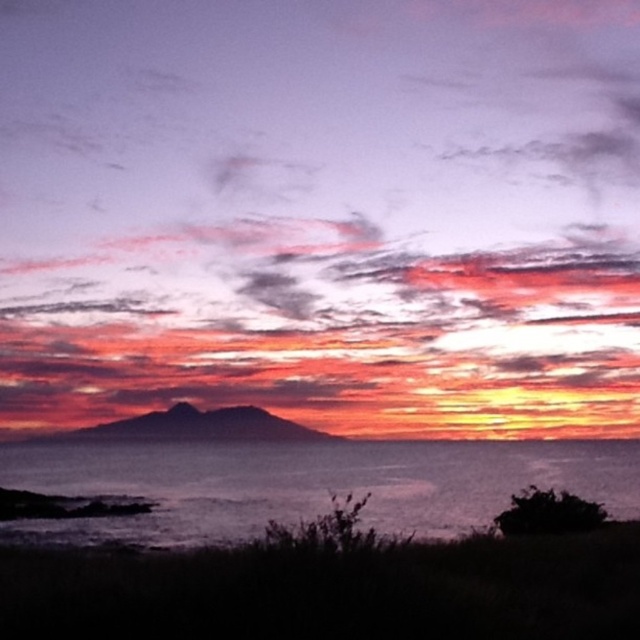
Question: Which object is closer to the camera taking this photo?

Choices:
 (A) matte pink cloud at center
 (B) dark blue water at lower center

Answer: (B)

Question: Which object is closer to the camera taking this photo?

Choices:
 (A) dark blue water at lower center
 (B) matte pink cloud at center

Answer: (A)

Question: Can you confirm if matte pink cloud at center is positioned to the left of dark blue water at lower center?

Choices:
 (A) no
 (B) yes

Answer: (B)

Question: From the image, what is the correct spatial relationship of matte pink cloud at center in relation to dark blue water at lower center?

Choices:
 (A) right
 (B) left

Answer: (B)

Question: Where is matte pink cloud at center located in relation to dark blue water at lower center in the image?

Choices:
 (A) below
 (B) above

Answer: (B)

Question: Which point is closer to the camera taking this photo?

Choices:
 (A) (106, 246)
 (B) (589, 481)

Answer: (B)